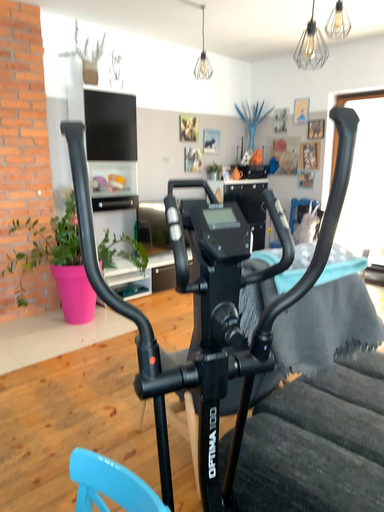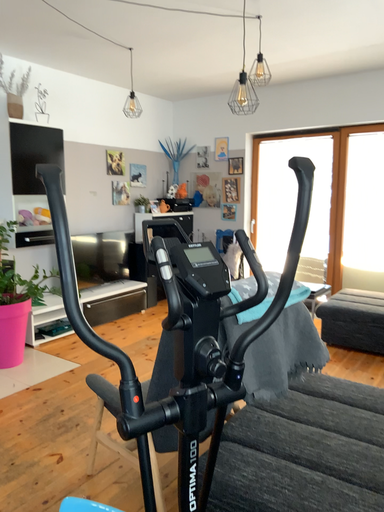
Question: How did the camera likely rotate when shooting the video?

Choices:
 (A) rotated right
 (B) rotated left

Answer: (A)